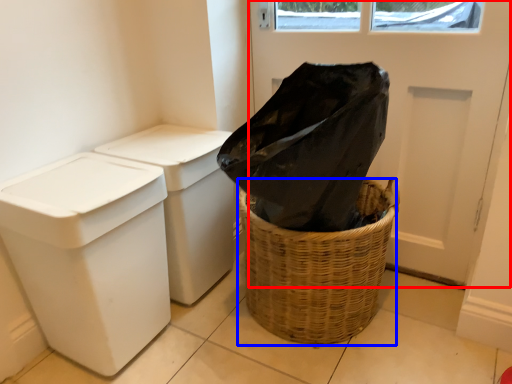
Question: Which object appears closest to the camera in this image, screen door (highlighted by a red box) or basket container (highlighted by a blue box)?

Choices:
 (A) screen door
 (B) basket container

Answer: (B)